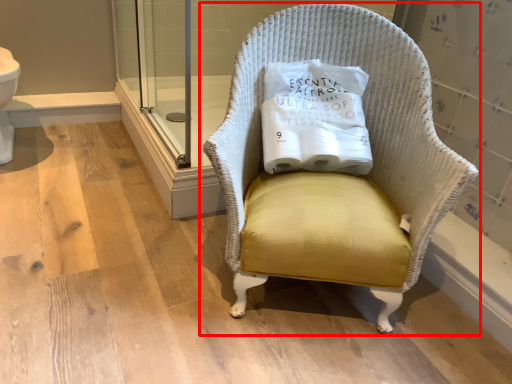
Question: Observing the image, what is the correct spatial positioning of chair (annotated by the red box) in reference to pillow?

Choices:
 (A) right
 (B) left

Answer: (A)